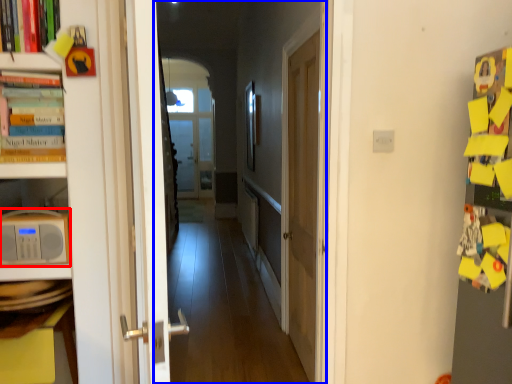
Question: Which of the following is the farthest to the observer, appliance (highlighted by a red box) or corridor (highlighted by a blue box)?

Choices:
 (A) appliance
 (B) corridor

Answer: (A)